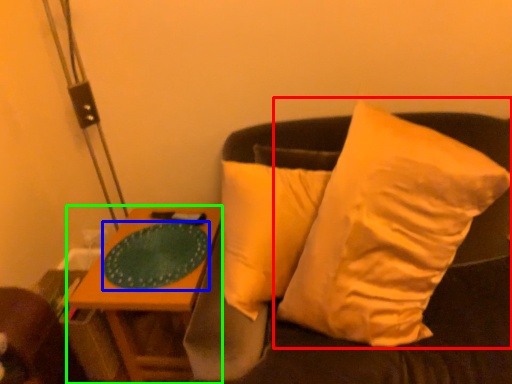
Question: Estimate the real-world distances between objects in this image. Which object is farther from pillow (highlighted by a red box), glass plate (highlighted by a blue box) or table (highlighted by a green box)?

Choices:
 (A) glass plate
 (B) table

Answer: (B)